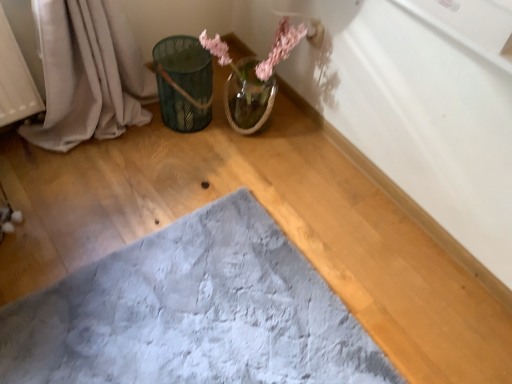
Where is `green metallic bucket at upper left`? Image resolution: width=512 pixels, height=384 pixels. green metallic bucket at upper left is located at coordinates (184, 82).

What are the coordinates of `green metallic bucket at upper left` in the screenshot? It's located at (184, 82).

Is translucent glass vase at upper center thinner than soft gray plush bath mat at center?

Yes.

Which is more to the right, translucent glass vase at upper center or soft gray plush bath mat at center?

translucent glass vase at upper center is more to the right.

Is translucent glass vase at upper center aimed at soft gray plush bath mat at center?

No, translucent glass vase at upper center is not oriented towards soft gray plush bath mat at center.

Is translucent glass vase at upper center completely or partially outside of soft gray plush bath mat at center?

That's correct, translucent glass vase at upper center is outside of soft gray plush bath mat at center.

Does green metallic bucket at upper left turn towards translucent glass vase at upper center?

No, green metallic bucket at upper left is not facing towards translucent glass vase at upper center.

Is green metallic bucket at upper left in front of or behind translucent glass vase at upper center in the image?

Clearly, green metallic bucket at upper left is behind translucent glass vase at upper center.

In the scene shown: Which is closer, (205, 83) or (219, 58)?

Clearly, point (205, 83) is closer to the camera than point (219, 58).

In terms of height, does green metallic bucket at upper left look taller or shorter compared to translucent glass vase at upper center?

Clearly, green metallic bucket at upper left is shorter compared to translucent glass vase at upper center.

Between soft gray plush bath mat at center and green metallic bucket at upper left, which one has less height?

soft gray plush bath mat at center is shorter.

Which object is thinner, soft gray plush bath mat at center or green metallic bucket at upper left?

Thinner between the two is green metallic bucket at upper left.

From a real-world perspective, is soft gray plush bath mat at center positioned under green metallic bucket at upper left based on gravity?

Yes, from a real-world perspective, soft gray plush bath mat at center is beneath green metallic bucket at upper left.

How distant is soft gray plush bath mat at center from green metallic bucket at upper left?

A distance of 26.34 inches exists between soft gray plush bath mat at center and green metallic bucket at upper left.

From the image's perspective, is soft gray plush bath mat at center above translucent glass vase at upper center?

No, from the image's perspective, soft gray plush bath mat at center is not on top of translucent glass vase at upper center.

In the image, is soft gray plush bath mat at center on the left side or the right side of translucent glass vase at upper center?

In the image, soft gray plush bath mat at center appears on the left side of translucent glass vase at upper center.

Who is shorter, soft gray plush bath mat at center or translucent glass vase at upper center?

With less height is soft gray plush bath mat at center.

How different are the orientations of translucent glass vase at upper center and green metallic bucket at upper left in degrees?

The facing directions of translucent glass vase at upper center and green metallic bucket at upper left are 90 degrees apart.

From their relative heights in the image, would you say translucent glass vase at upper center is taller or shorter than green metallic bucket at upper left?

Clearly, translucent glass vase at upper center is taller compared to green metallic bucket at upper left.

Is translucent glass vase at upper center positioned with its back to green metallic bucket at upper left?

No.

Does translucent glass vase at upper center have a greater width compared to green metallic bucket at upper left?

Yes, translucent glass vase at upper center is wider than green metallic bucket at upper left.

From a real-world perspective, relative to soft gray plush bath mat at center, is green metallic bucket at upper left vertically above or below?

green metallic bucket at upper left is above soft gray plush bath mat at center.

Could soft gray plush bath mat at center be considered to be inside green metallic bucket at upper left?

No, soft gray plush bath mat at center is located outside of green metallic bucket at upper left.

Does point (190, 52) come behind point (279, 300)?

That is True.

In the scene shown: Considering the sizes of objects green metallic bucket at upper left and soft gray plush bath mat at center in the image provided, who is taller, green metallic bucket at upper left or soft gray plush bath mat at center?

With more height is green metallic bucket at upper left.

The height and width of the screenshot is (384, 512). I want to click on floral arrangement above the soft gray plush bath mat at center (from the image's perspective), so click(280, 47).

The height and width of the screenshot is (384, 512). What are the coordinates of `flower basket behind the translucent glass vase at upper center` in the screenshot? It's located at (x=184, y=82).

From the image, which object appears to be farther from translucent glass vase at upper center, green metallic bucket at upper left or soft gray plush bath mat at center?

soft gray plush bath mat at center is further to translucent glass vase at upper center.

Which object lies further to the anchor point soft gray plush bath mat at center, green metallic bucket at upper left or translucent glass vase at upper center?

Among the two, translucent glass vase at upper center is located further to soft gray plush bath mat at center.

From the image, which object appears to be farther from green metallic bucket at upper left, translucent glass vase at upper center or soft gray plush bath mat at center?

soft gray plush bath mat at center lies further to green metallic bucket at upper left than the other object.

Which object lies further to the anchor point translucent glass vase at upper center, soft gray plush bath mat at center or green metallic bucket at upper left?

soft gray plush bath mat at center.

Which object lies further to the anchor point green metallic bucket at upper left, soft gray plush bath mat at center or translucent glass vase at upper center?

The object further to green metallic bucket at upper left is soft gray plush bath mat at center.

Consider the image. Looking at the image, which one is located further to soft gray plush bath mat at center, translucent glass vase at upper center or green metallic bucket at upper left?

translucent glass vase at upper center is further to soft gray plush bath mat at center.

Identify the location of flower basket between translucent glass vase at upper center and soft gray plush bath mat at center from top to bottom. (184, 82).